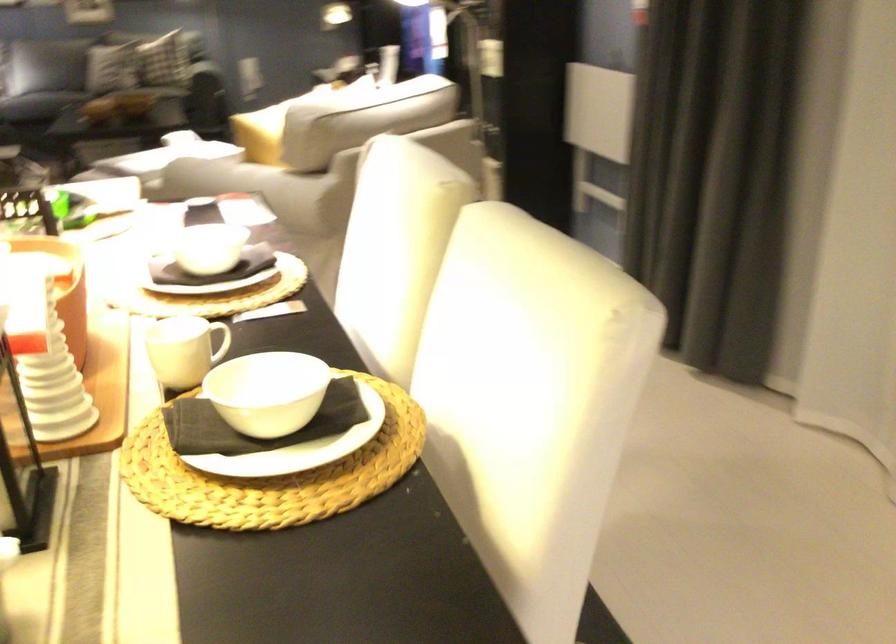
At what (x,y) coordinates should I click in order to perform the action: click on white mug handle. Please return your answer as a coordinate pair (x, y). This screenshot has width=896, height=644. Looking at the image, I should click on (219, 341).